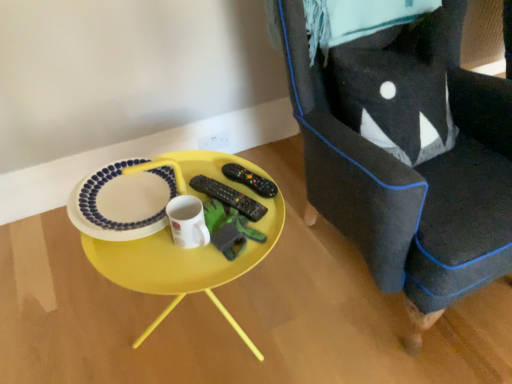
Find the location of `black plastic remote control at center, the 2th remote control in the left-to-right sequence`. black plastic remote control at center, the 2th remote control in the left-to-right sequence is located at coordinates (250, 180).

In order to face velvet dark blue armchair at right, should I rotate leftwards or rightwards?

A 20.956 degree turn to the right will do.

Find the location of `black plastic remote control at center, the first remote control positioned from the right`. black plastic remote control at center, the first remote control positioned from the right is located at coordinates (250, 180).

Consider the image. Which is in front, white glossy platter at center or yellow plastic table at center?

Positioned in front is yellow plastic table at center.

Is point (92, 192) closer or farther from the camera than point (246, 162)?

Clearly, point (92, 192) is closer to the camera than point (246, 162).

From the image's perspective, which object appears higher, white glossy platter at center or yellow plastic table at center?

white glossy platter at center is shown above in the image.

From a real-world perspective, which object rests below the other?

black matte remote control at center, marked as the 2th remote control in a right-to-left arrangement, from a real-world perspective.

Considering the positions of point (194, 247) and point (247, 206), is point (194, 247) closer or farther from the camera than point (247, 206)?

Clearly, point (194, 247) is closer to the camera than point (247, 206).

Find the location of a particular element. This screenshot has height=384, width=512. remote control that is the 1st one when counting upward from the white glossy mug at center (from the image's perspective) is located at coordinates (x=229, y=197).

In the image, is white glossy mug at center positioned in front of or behind black matte remote control at center, marked as the 2th remote control in a right-to-left arrangement?

In the image, white glossy mug at center appears in front of black matte remote control at center, marked as the 2th remote control in a right-to-left arrangement.

Does black plastic remote control at center, the first remote control positioned from the right, lie in front of white glossy platter at center?

No.

Which is behind, point (267, 196) or point (97, 219)?

The point (267, 196) is farther.

From the picture: Does black plastic remote control at center, the 2th remote control in the left-to-right sequence, appear on the left side of white glossy platter at center?

In fact, black plastic remote control at center, the 2th remote control in the left-to-right sequence, is to the right of white glossy platter at center.

This screenshot has height=384, width=512. What are the coordinates of `platter that appears below the black plastic remote control at center, the first remote control positioned from the right (from the image's perspective)` in the screenshot? It's located at (123, 201).

Considering the points (246, 198) and (263, 178), which point is behind, point (246, 198) or point (263, 178)?

Positioned behind is point (263, 178).

Can you confirm if black matte remote control at center, the 1th remote control from the left, is shorter than black plastic remote control at center, the first remote control positioned from the right?

Correct, black matte remote control at center, the 1th remote control from the left, is not as tall as black plastic remote control at center, the first remote control positioned from the right.

Which object is closer to the camera taking this photo, black matte remote control at center, marked as the 2th remote control in a right-to-left arrangement, or black plastic remote control at center, the 2th remote control in the left-to-right sequence?

black matte remote control at center, marked as the 2th remote control in a right-to-left arrangement, is more forward.

From a real-world perspective, which object stands above the other?

black matte remote control at center, the 1th remote control from the left, is physically above.

Between green felt toy at center and velvet dark blue armchair at right, which one is positioned in front?

velvet dark blue armchair at right.

What are the coordinates of `chair that is above the green felt toy at center (from a real-world perspective)` in the screenshot? It's located at (403, 145).

Between green felt toy at center and velvet dark blue armchair at right, which one has larger size?

With larger size is velvet dark blue armchair at right.

Is green felt toy at center far away from velvet dark blue armchair at right?

That's not correct — green felt toy at center is a little close to velvet dark blue armchair at right.

In the scene shown: Which is further, (201, 267) or (386, 256)?

The point (386, 256) is behind.

Based on their positions, is yellow plastic table at center located to the left or right of velvet dark blue armchair at right?

yellow plastic table at center is positioned on velvet dark blue armchair at right's left side.

Considering the relative positions of yellow plastic table at center and velvet dark blue armchair at right in the image provided, is yellow plastic table at center behind velvet dark blue armchair at right?

Yes, it is behind velvet dark blue armchair at right.

Is yellow plastic table at center taller than velvet dark blue armchair at right?

Incorrect, the height of yellow plastic table at center is not larger of that of velvet dark blue armchair at right.

Looking at this image, based on their sizes in the image, would you say yellow plastic table at center is bigger or smaller than white glossy platter at center?

Considering their sizes, yellow plastic table at center takes up more space than white glossy platter at center.

Considering the relative sizes of yellow plastic table at center and white glossy platter at center in the image provided, is yellow plastic table at center wider than white glossy platter at center?

Yes, yellow plastic table at center is wider than white glossy platter at center.

Considering their positions, is yellow plastic table at center located in front of or behind white glossy platter at center?

Visually, yellow plastic table at center is located in front of white glossy platter at center.

Is yellow plastic table at center spatially inside white glossy platter at center, or outside of it?

yellow plastic table at center lies outside white glossy platter at center.

Where is `platter located behind the yellow plastic table at center`? This screenshot has height=384, width=512. platter located behind the yellow plastic table at center is located at coordinates (123, 201).

You are a GUI agent. You are given a task and a screenshot of the screen. Output one action in this format:
    pyautogui.click(x=<x>, y=<y>)
    Task: Click on the coffee cup located below the black matte remote control at center, marked as the 2th remote control in a right-to-left arrangement (from the image's perspective)
    The width and height of the screenshot is (512, 384).
    Given the screenshot: What is the action you would take?
    187,222

When comparing their distances from white glossy mug at center, does black matte remote control at center, the 1th remote control from the left, or black plastic remote control at center, the first remote control positioned from the right, seem further?

black plastic remote control at center, the first remote control positioned from the right, is further to white glossy mug at center.

Considering their positions, is black matte remote control at center, the 1th remote control from the left, positioned further to velvet dark blue armchair at right than yellow plastic table at center?

Based on the image, black matte remote control at center, the 1th remote control from the left, appears to be further to velvet dark blue armchair at right.

From the image, which object appears to be nearer to black matte remote control at center, the 1th remote control from the left, green felt toy at center or white glossy platter at center?

The object closer to black matte remote control at center, the 1th remote control from the left, is green felt toy at center.

In the scene shown: Considering their positions, is black plastic remote control at center, the first remote control positioned from the right, positioned further to yellow plastic table at center than white glossy mug at center?

black plastic remote control at center, the first remote control positioned from the right, is further to yellow plastic table at center.

Looking at the image, which one is located further to black plastic remote control at center, the first remote control positioned from the right, white glossy platter at center or white glossy mug at center?

The object further to black plastic remote control at center, the first remote control positioned from the right, is white glossy platter at center.

Looking at the image, which one is located further to yellow plastic table at center, white glossy mug at center or white glossy platter at center?

white glossy mug at center is positioned further to the anchor yellow plastic table at center.

Which object lies further to the anchor point velvet dark blue armchair at right, green felt toy at center or black matte remote control at center, the 1th remote control from the left?

Among the two, green felt toy at center is located further to velvet dark blue armchair at right.

When comparing their distances from black plastic remote control at center, the first remote control positioned from the right, does green felt toy at center or black matte remote control at center, the 1th remote control from the left, seem closer?

Among the two, black matte remote control at center, the 1th remote control from the left, is located nearer to black plastic remote control at center, the first remote control positioned from the right.

Find the location of `remote control between white glossy platter at center and green felt toy at center`. remote control between white glossy platter at center and green felt toy at center is located at coordinates (229, 197).

Image resolution: width=512 pixels, height=384 pixels. I want to click on toy located between white glossy mug at center and velvet dark blue armchair at right in the left-right direction, so click(x=229, y=229).

The width and height of the screenshot is (512, 384). Find the location of `coffee cup between yellow plastic table at center and black plastic remote control at center, the first remote control positioned from the right, in the front-back direction`. coffee cup between yellow plastic table at center and black plastic remote control at center, the first remote control positioned from the right, in the front-back direction is located at coordinates (187, 222).

The width and height of the screenshot is (512, 384). I want to click on remote control between white glossy platter at center and black plastic remote control at center, the 2th remote control in the left-to-right sequence, in the horizontal direction, so click(x=229, y=197).